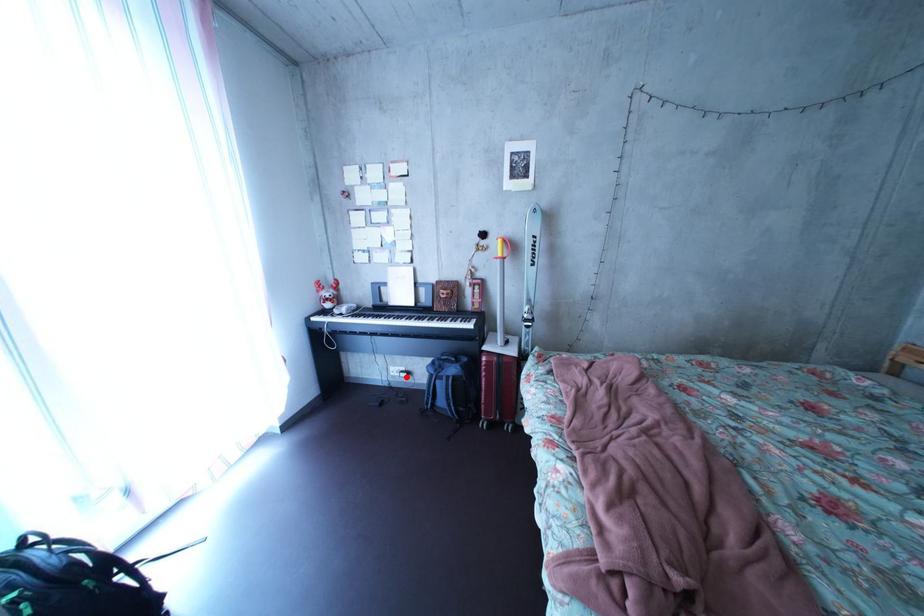
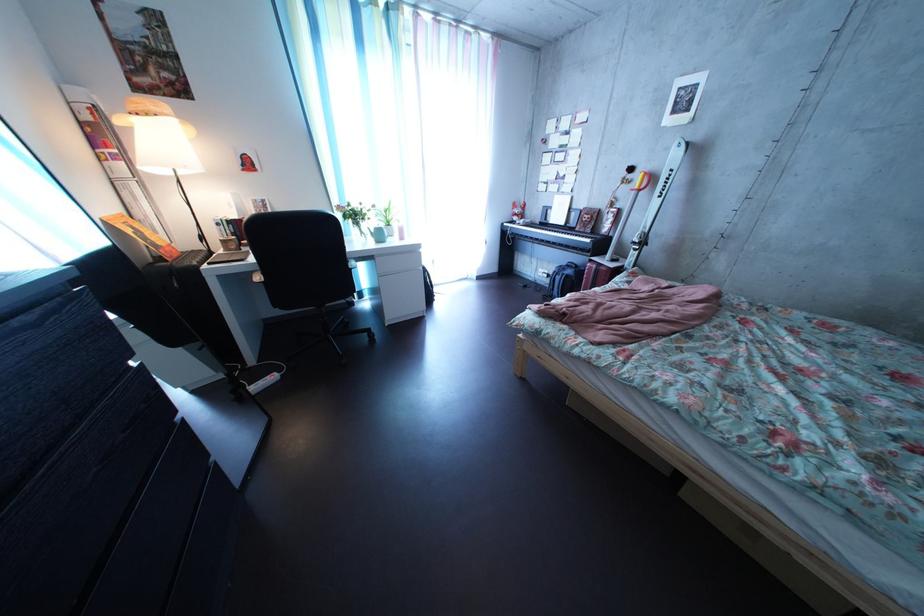
Question: I am providing you with two images of the same scene from different viewpoints. A red point is marked on the first image. At the location where the point appears in image 1, is it still visible in image 2?

Choices:
 (A) Yes
 (B) No

Answer: (A)